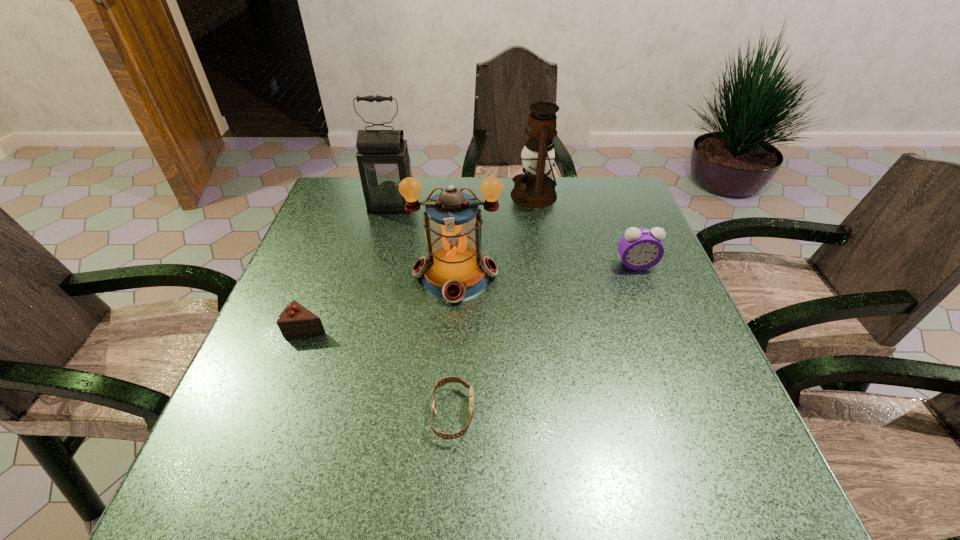
Where is `free point that satisfies the following two spatial constraints: 1. on the side of the rightmost lantern, there is a wick adjustment knob; 2. on the front-facing side of the leftmost lantern`? Image resolution: width=960 pixels, height=540 pixels. free point that satisfies the following two spatial constraints: 1. on the side of the rightmost lantern, there is a wick adjustment knob; 2. on the front-facing side of the leftmost lantern is located at coordinates (536, 204).

You are a GUI agent. You are given a task and a screenshot of the screen. Output one action in this format:
    pyautogui.click(x=<x>, y=<y>)
    Task: Click on the free space that satisfies the following two spatial constraints: 1. on the side of the rightmost lantern, there is a wick adjustment knob; 2. on the front-facing side of the fourth shortest object
    The height and width of the screenshot is (540, 960).
    Given the screenshot: What is the action you would take?
    pyautogui.click(x=547, y=275)